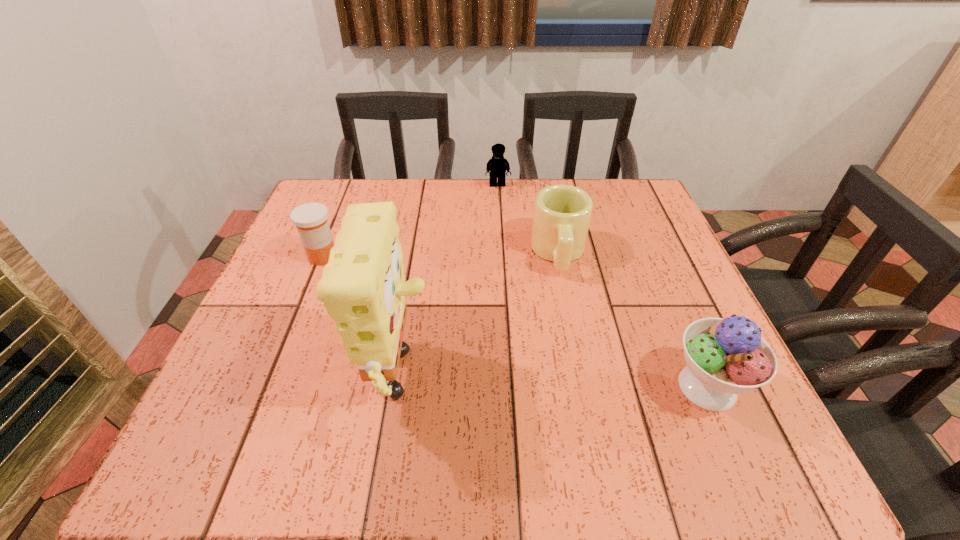
Find the location of `free space on the desktop that is between the fourth object from right to left and the rightmost object and is positioned on the front-facing side of the third object from left to right`. free space on the desktop that is between the fourth object from right to left and the rightmost object and is positioned on the front-facing side of the third object from left to right is located at coordinates click(x=525, y=387).

Identify the location of free spot on the desktop that is between the fourth object from right to left and the icecream and is positioned on the label of the leftmost object. (588, 387).

The height and width of the screenshot is (540, 960). In order to click on free space on the desktop that is between the sponge and the fourth shortest object and is positioned with the handle on the side of the fourth object from left to right in this screenshot , I will do `click(572, 387)`.